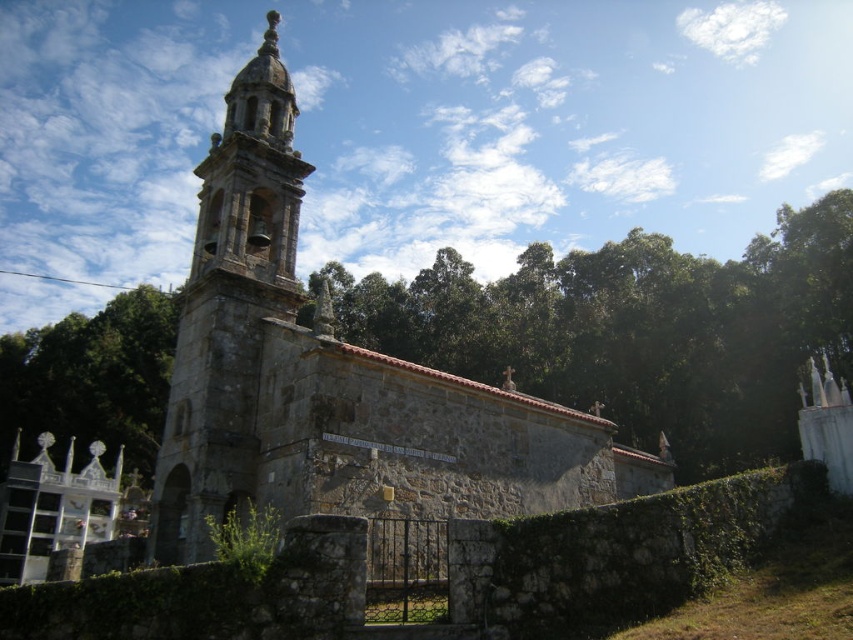
Question: Can you confirm if stone church at center is thinner than green leafy trees at center?

Choices:
 (A) no
 (B) yes

Answer: (B)

Question: Which point is farther to the camera?

Choices:
 (A) green leafy trees at center
 (B) stone church at center
 (C) green leafy tree at left

Answer: (A)

Question: Does green leafy trees at center come behind green leafy tree at left?

Choices:
 (A) yes
 (B) no

Answer: (A)

Question: Can you confirm if green leafy trees at center is positioned to the left of green leafy tree at left?

Choices:
 (A) no
 (B) yes

Answer: (A)

Question: Which of the following is the closest to the observer?

Choices:
 (A) stone church at center
 (B) green leafy tree at left
 (C) green leafy trees at center

Answer: (A)

Question: Which point appears farthest from the camera in this image?

Choices:
 (A) tap(737, 275)
 (B) tap(138, 333)
 (C) tap(436, 513)

Answer: (B)